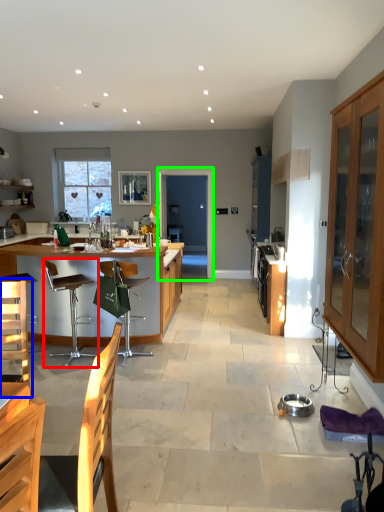
Question: Which is nearer to the chair (highlighted by a red box)? armchair (highlighted by a blue box) or glass door (highlighted by a green box).

Choices:
 (A) armchair
 (B) glass door

Answer: (A)